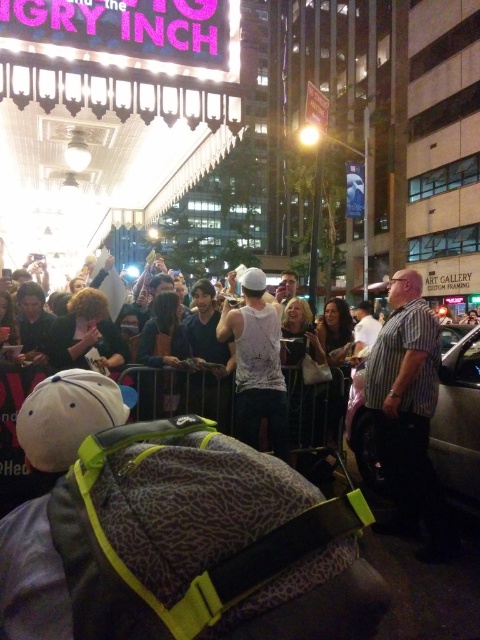
You are a photographer at the event and need to capture a clear shot of both the striped cotton shirt at center and the white cotton tank top at center. Since you want to ensure both are visible, which clothing item should you focus on first to account for their height difference?

The striped cotton shirt at center is taller than the white cotton tank top at center, so you should focus on the striped cotton shirt at center first to ensure its full height is captured before adjusting the frame to include the shorter white cotton tank top at center.